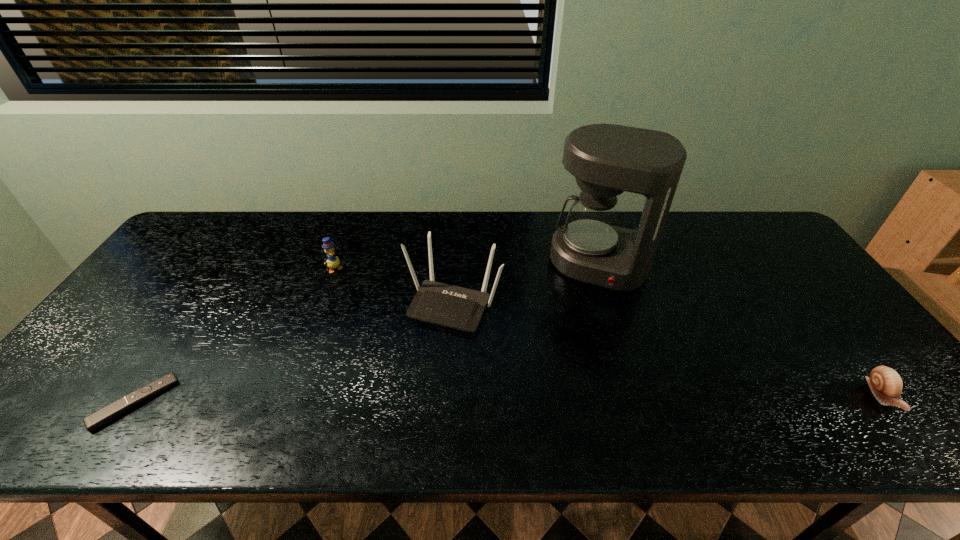
The width and height of the screenshot is (960, 540). Find the location of `vacant space in between the fourth shortest object and the fourth tallest object`. vacant space in between the fourth shortest object and the fourth tallest object is located at coordinates (667, 350).

Find the location of a particular element. vacant point located between the duckling and the rightmost object is located at coordinates (609, 333).

Locate an element on the screen. The height and width of the screenshot is (540, 960). free space between the fourth tallest object and the fourth object from left to right is located at coordinates (740, 330).

Choose which object is the nearest neighbor to the third object from right to left. Please provide its 2D coordinates. Your answer should be formatted as a tuple, i.e. [(x, y)], where the tuple contains the x and y coordinates of a point satisfying the conditions above.

[(606, 159)]

Select which object appears as the closest to the second object from left to right. Please provide its 2D coordinates. Your answer should be formatted as a tuple, i.e. [(x, y)], where the tuple contains the x and y coordinates of a point satisfying the conditions above.

[(443, 304)]

At what (x,y) coordinates should I click in order to perform the action: click on free spot that satisfies the following two spatial constraints: 1. on the back side of the remote control; 2. on the right side of the second object from left to right. Please return your answer as a coordinate pair (x, y). This screenshot has width=960, height=540. Looking at the image, I should click on (223, 269).